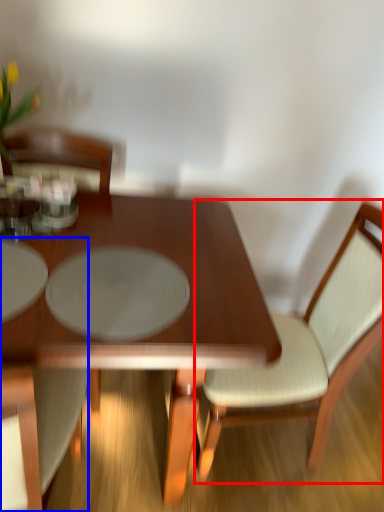
Question: Which object is further to the camera taking this photo, chair (highlighted by a red box) or chair (highlighted by a blue box)?

Choices:
 (A) chair
 (B) chair

Answer: (A)